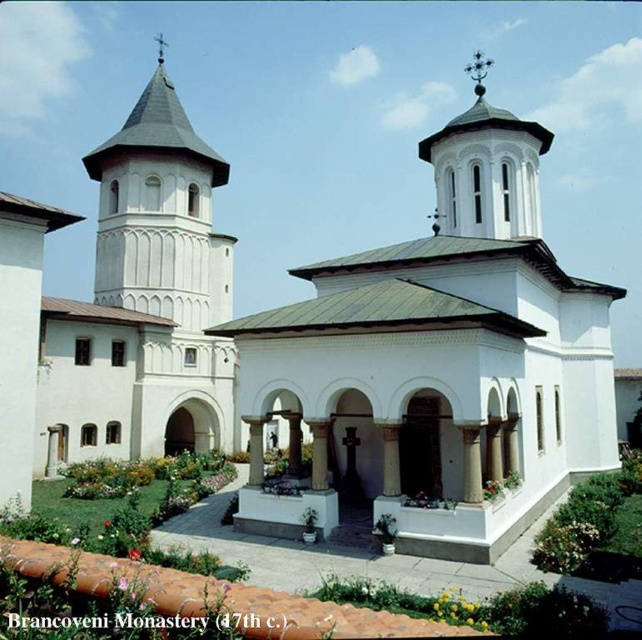
You are standing at the point marked by coordinates (438, 362) in the image of Branoveni Monastery. Based on the scene description, what structure are you currently located in?

The point marked by coordinates (438, 362) is on the white smooth chapel at center.

You are a maintenance worker tasked with inspecting the distance between the two white stucco towers at the Branoveni Monastery. Given that your ladder can extend up to 50 feet, can you safely reach the white stucco tower at upper center from the white stucco tower at left without needing additional equipment?

The white stucco tower at left is 54.57 feet from the white stucco tower at upper center. Since your ladder can only extend to 50 feet, you cannot safely reach the white stucco tower at upper center from the white stucco tower at left without additional equipment.

In the scene shown: You are standing at the entrance of the Branoveni Monastery. You see a point marked at coordinates (160, 214). What object does this point correspond to?

The point corresponds to the white stucco tower at left.